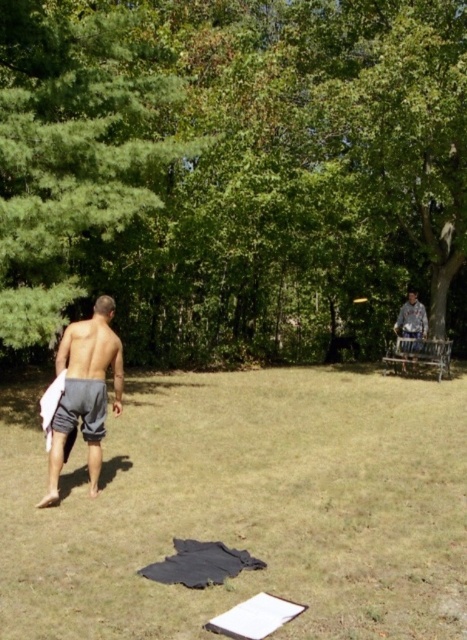
Question: Can you confirm if green grass at center is positioned below metallic silver frisbee at center?

Choices:
 (A) no
 (B) yes

Answer: (B)

Question: Estimate the real-world distances between objects in this image. Which object is farther from the metallic silver frisbee at center?

Choices:
 (A) green leafy tree at upper center
 (B) green leafy tree at left

Answer: (B)

Question: Does gray cotton shorts at left appear on the left side of gray cotton shorts at lower left?

Choices:
 (A) no
 (B) yes

Answer: (B)

Question: Can you confirm if gray cotton shorts at left is positioned to the left of camouflage fabric shirt at right?

Choices:
 (A) yes
 (B) no

Answer: (A)

Question: Which is farther from the camouflage fabric shirt at right?

Choices:
 (A) metallic silver frisbee at center
 (B) green grass at center
 (C) gray cotton shorts at left

Answer: (C)

Question: Considering the real-world distances, which object is closest to the green leafy tree at upper center?

Choices:
 (A) gray cotton shorts at lower left
 (B) metallic silver frisbee at center
 (C) green leafy tree at left
 (D) gray cotton shorts at left

Answer: (B)